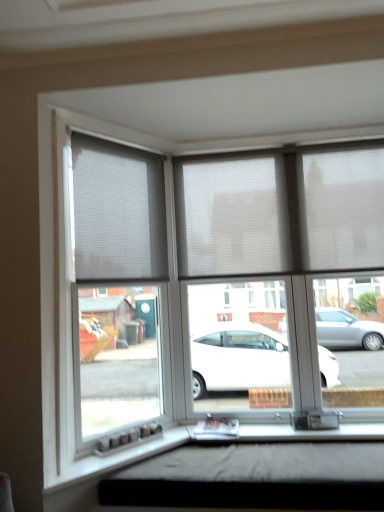
Question: Is white pleated blinds at center at the back of white pleated blind at upper left?

Choices:
 (A) yes
 (B) no

Answer: (B)

Question: Does white pleated blind at upper left come in front of white pleated blinds at center?

Choices:
 (A) yes
 (B) no

Answer: (A)

Question: From a real-world perspective, is white pleated blind at upper left located beneath white pleated blinds at center?

Choices:
 (A) yes
 (B) no

Answer: (B)

Question: Does white pleated blind at upper left appear on the right side of white pleated blinds at center?

Choices:
 (A) yes
 (B) no

Answer: (B)

Question: From the image's perspective, is white pleated blind at upper left over white pleated blinds at center?

Choices:
 (A) yes
 (B) no

Answer: (B)

Question: From a real-world perspective, is white pleated blind at upper left positioned above or below black matte window box at lower center?

Choices:
 (A) above
 (B) below

Answer: (A)

Question: Considering the positions of white pleated blind at upper left and black matte window box at lower center in the image, is white pleated blind at upper left taller or shorter than black matte window box at lower center?

Choices:
 (A) short
 (B) tall

Answer: (B)

Question: Is point (152, 221) closer or farther from the camera than point (114, 503)?

Choices:
 (A) closer
 (B) farther

Answer: (B)

Question: In the image, is white pleated blind at upper left positioned in front of or behind black matte window box at lower center?

Choices:
 (A) front
 (B) behind

Answer: (B)

Question: Would you say black matte window box at lower center is inside or outside white pleated blinds at center?

Choices:
 (A) outside
 (B) inside

Answer: (A)

Question: In the image, is black matte window box at lower center positioned in front of or behind white pleated blinds at center?

Choices:
 (A) front
 (B) behind

Answer: (A)

Question: Does point (210, 500) appear closer or farther from the camera than point (365, 237)?

Choices:
 (A) closer
 (B) farther

Answer: (A)

Question: From the image's perspective, relative to white pleated blinds at center, is black matte window box at lower center above or below?

Choices:
 (A) below
 (B) above

Answer: (A)

Question: Looking at the image, does white pleated blinds at center seem bigger or smaller compared to black matte window box at lower center?

Choices:
 (A) small
 (B) big

Answer: (B)

Question: Is white pleated blinds at center situated inside black matte window box at lower center or outside?

Choices:
 (A) outside
 (B) inside

Answer: (A)